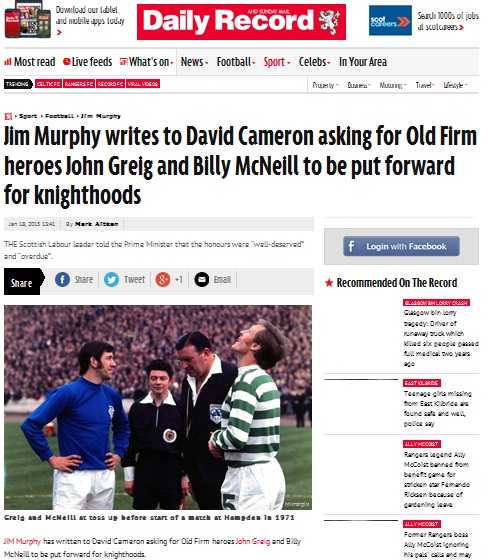
Identify the location of picture. (185, 365).